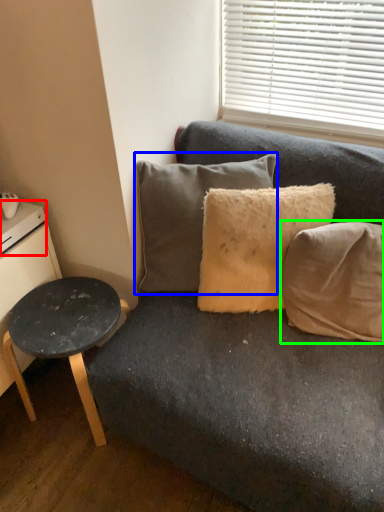
Question: Which object is positioned closest to drawer (highlighted by a red box)? Select from pillow (highlighted by a blue box) and pillow (highlighted by a green box).

Choices:
 (A) pillow
 (B) pillow

Answer: (A)